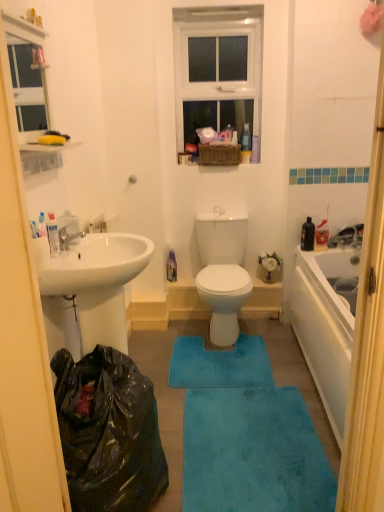
Question: From the image's perspective, is blue plush bath mat at center, the 2th bath mat from the top, beneath white plastic toothpaste tube at left?

Choices:
 (A) no
 (B) yes

Answer: (B)

Question: Is blue plush bath mat at center, which is the 1th bath mat from front to back, in contact with white plastic toothpaste tube at left?

Choices:
 (A) yes
 (B) no

Answer: (B)

Question: Does blue plush bath mat at center, positioned as the 2th bath mat in back-to-front order, have a lesser height compared to white plastic toothpaste tube at left?

Choices:
 (A) no
 (B) yes

Answer: (B)

Question: From a real-world perspective, is blue plush bath mat at center, positioned as the 2th bath mat in back-to-front order, positioned under white plastic toothpaste tube at left based on gravity?

Choices:
 (A) yes
 (B) no

Answer: (A)

Question: Can you confirm if blue plush bath mat at center, positioned as the 2th bath mat in back-to-front order, is positioned to the left of white plastic toothpaste tube at left?

Choices:
 (A) yes
 (B) no

Answer: (B)

Question: Is blue plush bath mat at center, the 2th bath mat from the top, at the right side of white plastic toothpaste tube at left?

Choices:
 (A) no
 (B) yes

Answer: (B)

Question: From the image's perspective, is matte silver faucet at left below black plastic bag at lower left?

Choices:
 (A) yes
 (B) no

Answer: (B)

Question: Is black plastic bag at lower left located within matte silver faucet at left?

Choices:
 (A) yes
 (B) no

Answer: (B)

Question: Can you confirm if matte silver faucet at left is taller than black plastic bag at lower left?

Choices:
 (A) yes
 (B) no

Answer: (B)

Question: Is matte silver faucet at left turned away from black plastic bag at lower left?

Choices:
 (A) yes
 (B) no

Answer: (B)

Question: Considering the relative sizes of matte silver faucet at left and black plastic bag at lower left in the image provided, is matte silver faucet at left wider than black plastic bag at lower left?

Choices:
 (A) yes
 (B) no

Answer: (B)

Question: Are matte silver faucet at left and black plastic bag at lower left beside each other?

Choices:
 (A) no
 (B) yes

Answer: (A)

Question: From the image's perspective, is white plastic toothpaste tube at left located above blue plush bath mat at center, which appears as the 1th bath mat when viewed from the top?

Choices:
 (A) no
 (B) yes

Answer: (B)